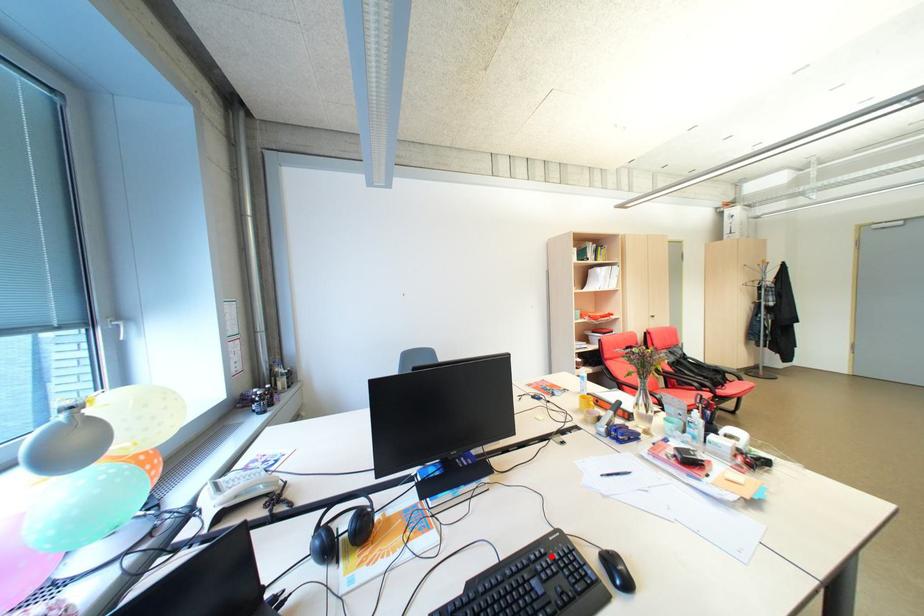
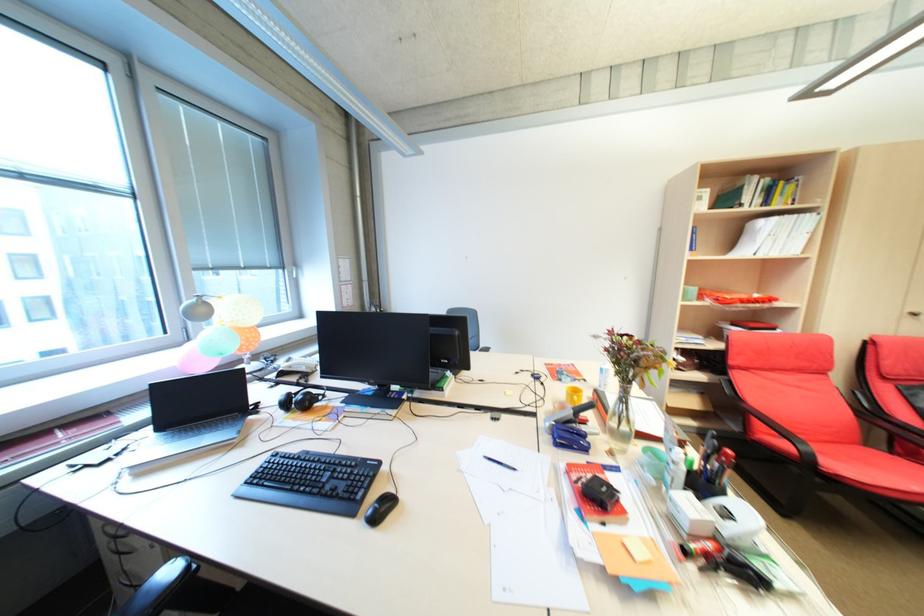
Question: I am providing you with two images of the same scene from different viewpoints. A red point is marked on the first image. At the location where the point appears in image 1, is it still visible in image 2?

Choices:
 (A) Yes
 (B) No

Answer: (A)